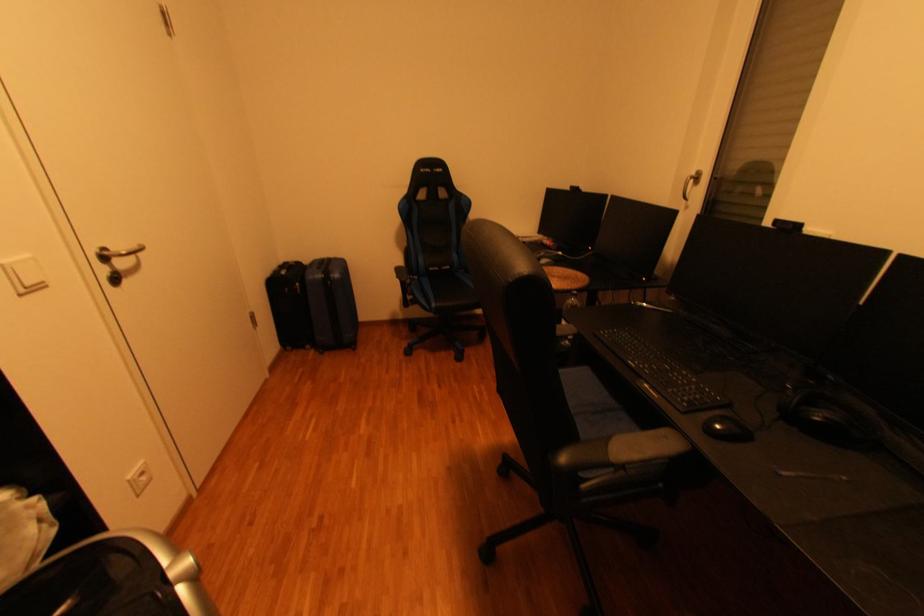
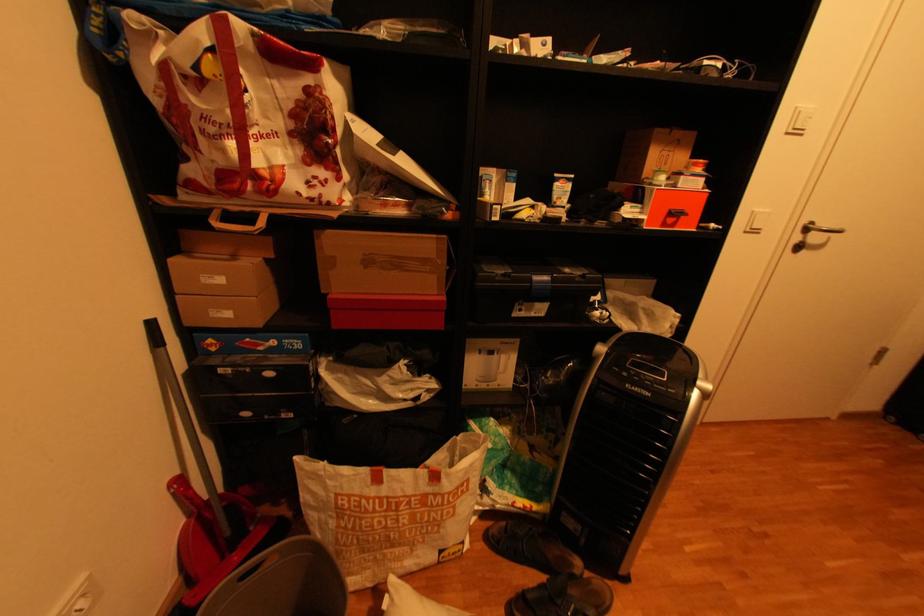
In the second image, find the point that corresponds to (x=114, y=259) in the first image.

(816, 230)